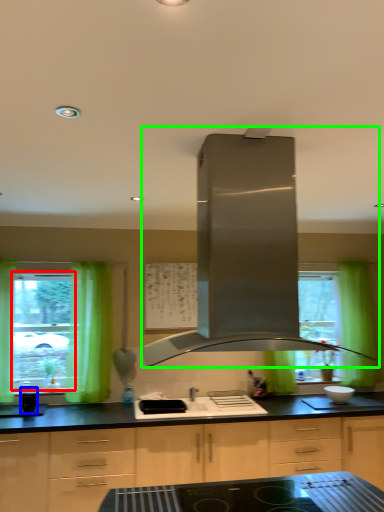
Question: Estimate the real-world distances between objects in this image. Which object is closer to window screen (highlighted by a red box), appliance (highlighted by a blue box) or home appliance (highlighted by a green box)?

Choices:
 (A) appliance
 (B) home appliance

Answer: (A)